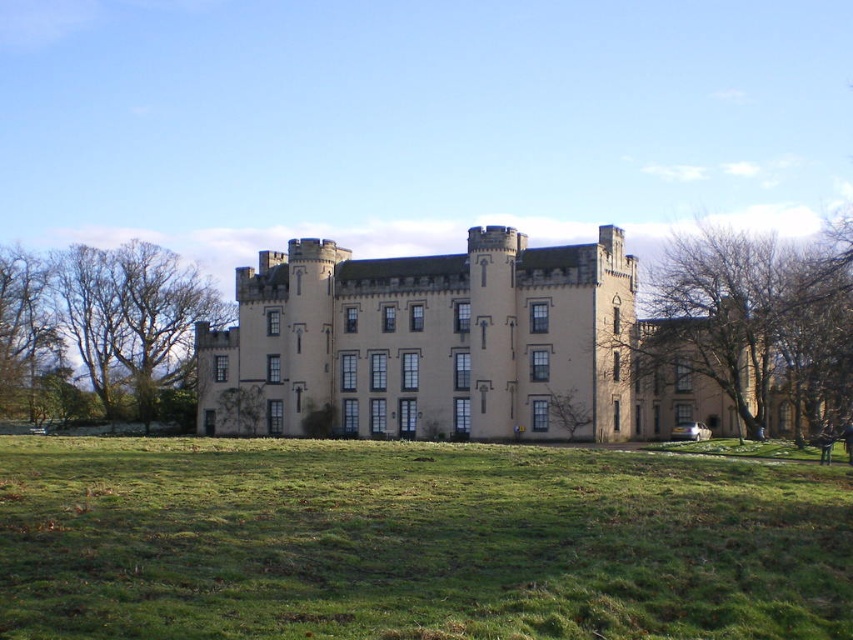
You are standing on the lawn in front of the historic building. You see two points marked on the ground. One is at point (364, 508) and the other is at point (16, 358). Which point is closer to you?

Point (364, 508) is closer to the viewer than point (16, 358).

You are standing in front of the historic building and notice two sets of bare branches. Which set, the bare branches at right or the bare branches at left, is positioned to the east side of the building?

The bare branches at right are to the east side of the building because they are positioned to the right of the bare branches at left, which would be on the west side.